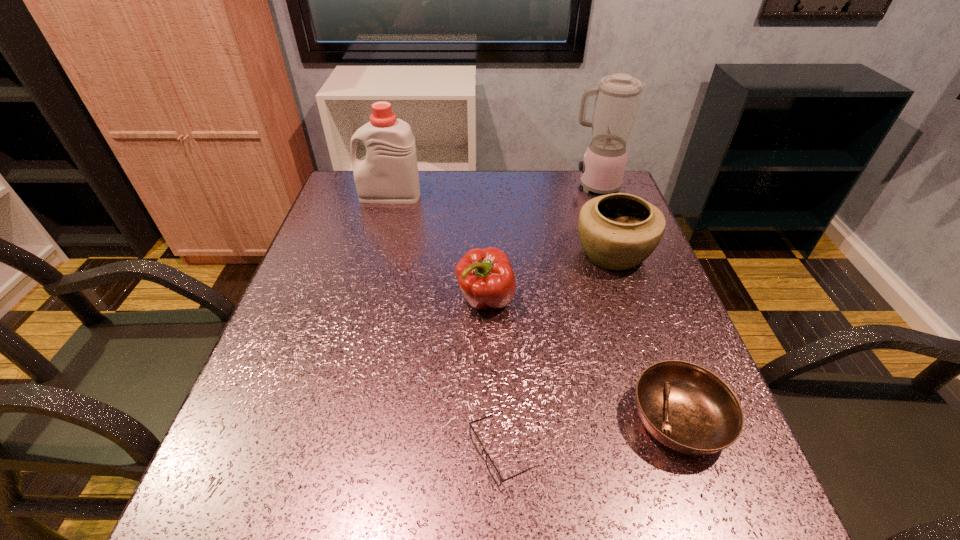
Where is `vacant region at the near left corner of the desktop`? vacant region at the near left corner of the desktop is located at coordinates (289, 508).

Where is `free space between the spectacles and the soup bowl`? free space between the spectacles and the soup bowl is located at coordinates (590, 436).

Where is `empty space that is in between the fifth tallest object and the leftmost object`? The height and width of the screenshot is (540, 960). empty space that is in between the fifth tallest object and the leftmost object is located at coordinates (535, 308).

Find the location of a particular element. The width and height of the screenshot is (960, 540). vacant space in between the pottery and the leftmost object is located at coordinates (501, 225).

Locate an element on the screen. The height and width of the screenshot is (540, 960). free spot between the pepper and the shortest object is located at coordinates (494, 376).

Find the location of `vacant area between the pottery and the leftmost object`. vacant area between the pottery and the leftmost object is located at coordinates (501, 225).

Locate an element on the screen. empty space that is in between the shortest object and the soup bowl is located at coordinates (590, 436).

Find the location of a particular element. Image resolution: width=960 pixels, height=540 pixels. vacant region between the leftmost object and the soup bowl is located at coordinates (535, 308).

Where is `vacant space that's between the soup bowl and the tallest object`? The image size is (960, 540). vacant space that's between the soup bowl and the tallest object is located at coordinates (636, 303).

Locate which object is the closest to the fifth tallest object. Please provide its 2D coordinates. Your answer should be formatted as a tuple, i.e. [(x, y)], where the tuple contains the x and y coordinates of a point satisfying the conditions above.

[(491, 467)]